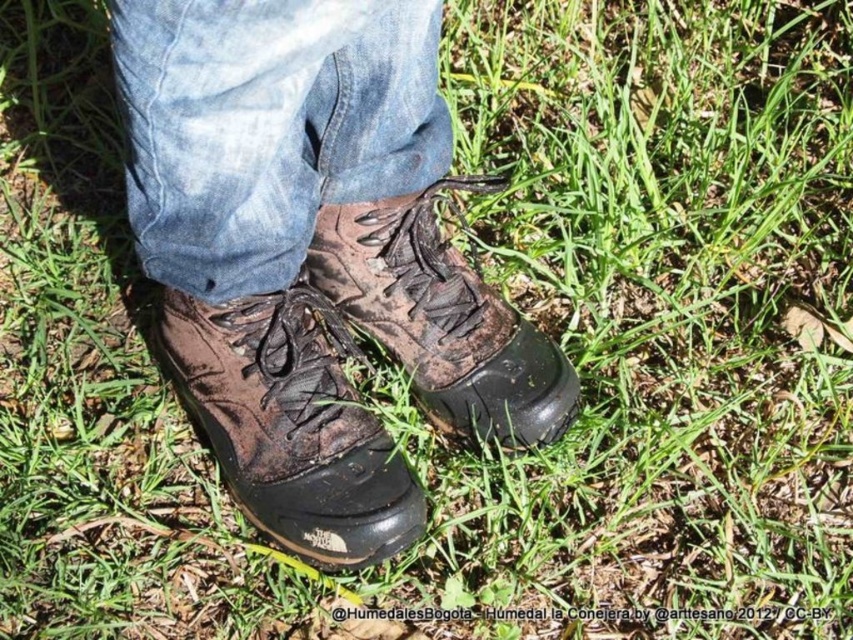
Is point (218, 84) more distant than point (448, 400)?

No, it is not.

Which of these two, denim at center or brown leather boot at center, stands taller?

With more height is brown leather boot at center.

Locate an element on the screen. The image size is (853, 640). denim at center is located at coordinates (268, 128).

From the picture: Does denim at center appear under brown suede boot at center?

No.

Which is behind, point (189, 195) or point (283, 406)?

The point (283, 406) is behind.

Where is `denim at center`? denim at center is located at coordinates (268, 128).

Which is behind, point (332, 426) or point (537, 337)?

The point (537, 337) is more distant.

Is point (248, 410) farther from camera compared to point (399, 314)?

No, (248, 410) is closer to viewer.

Find the location of a particular element. This screenshot has width=853, height=640. brown suede boot at center is located at coordinates (291, 422).